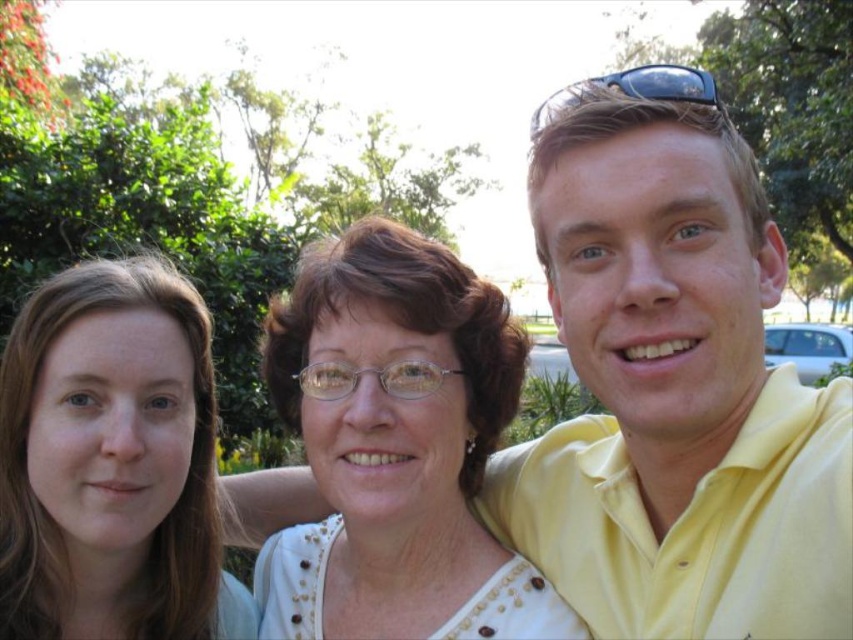
Question: Is white textured blouse at center positioned at the back of smooth skin face at left?

Choices:
 (A) yes
 (B) no

Answer: (A)

Question: Can you confirm if white textured blouse at center is positioned below black plastic sunglasses at upper right?

Choices:
 (A) no
 (B) yes

Answer: (B)

Question: Which object appears farthest from the camera in this image?

Choices:
 (A) yellow satin shirt at upper right
 (B) smooth skin face at left
 (C) black plastic sunglasses at upper right

Answer: (C)

Question: Which point is farther to the camera?

Choices:
 (A) smooth skin face at left
 (B) yellow satin shirt at upper right
 (C) white textured blouse at center

Answer: (C)

Question: Is smooth skin face at left wider than black plastic sunglasses at upper right?

Choices:
 (A) no
 (B) yes

Answer: (A)

Question: Among these points, which one is nearest to the camera?

Choices:
 (A) (701, 88)
 (B) (833, 451)
 (C) (103, 618)
 (D) (434, 556)

Answer: (B)